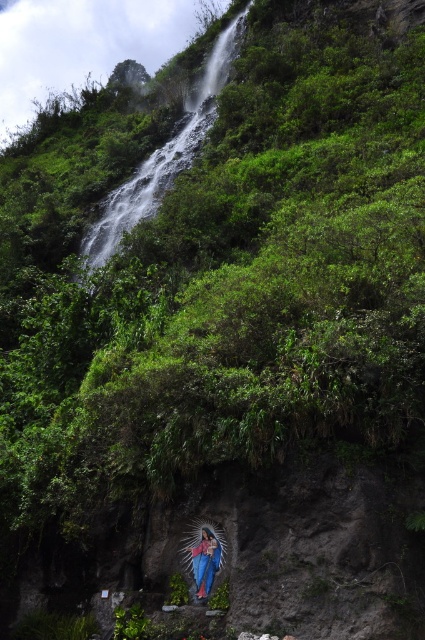
Question: Which point is closer to the camera taking this photo?

Choices:
 (A) (149, 196)
 (B) (206, 582)

Answer: (B)

Question: Can you confirm if green leafy waterfall at upper left is positioned above smooth blue statue at lower center?

Choices:
 (A) no
 (B) yes

Answer: (B)

Question: Which of the following is the closest to the observer?

Choices:
 (A) smooth blue statue at lower center
 (B) green leafy waterfall at upper left

Answer: (A)

Question: Does green leafy waterfall at upper left appear under smooth blue statue at lower center?

Choices:
 (A) yes
 (B) no

Answer: (B)

Question: Where is green leafy waterfall at upper left located in relation to smooth blue statue at lower center in the image?

Choices:
 (A) above
 (B) below

Answer: (A)